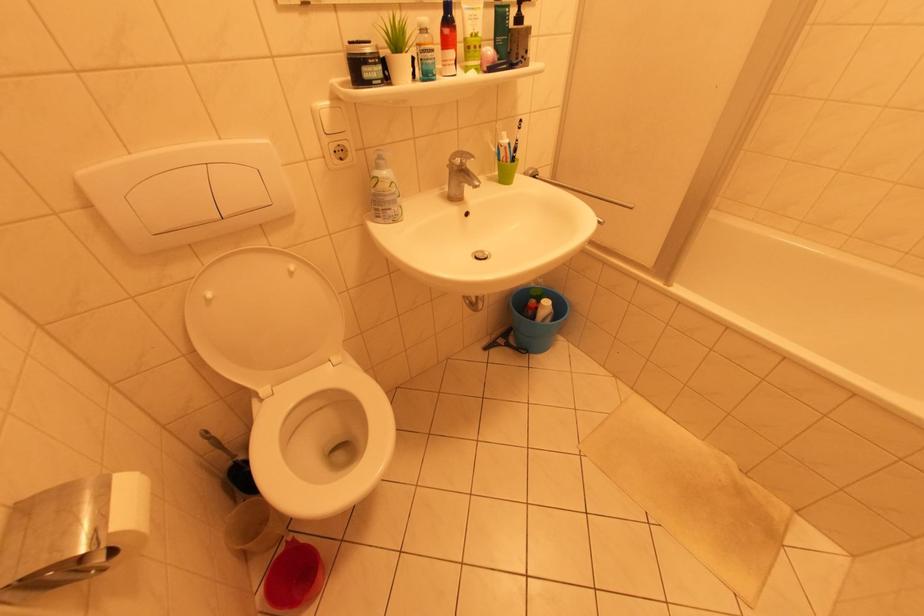
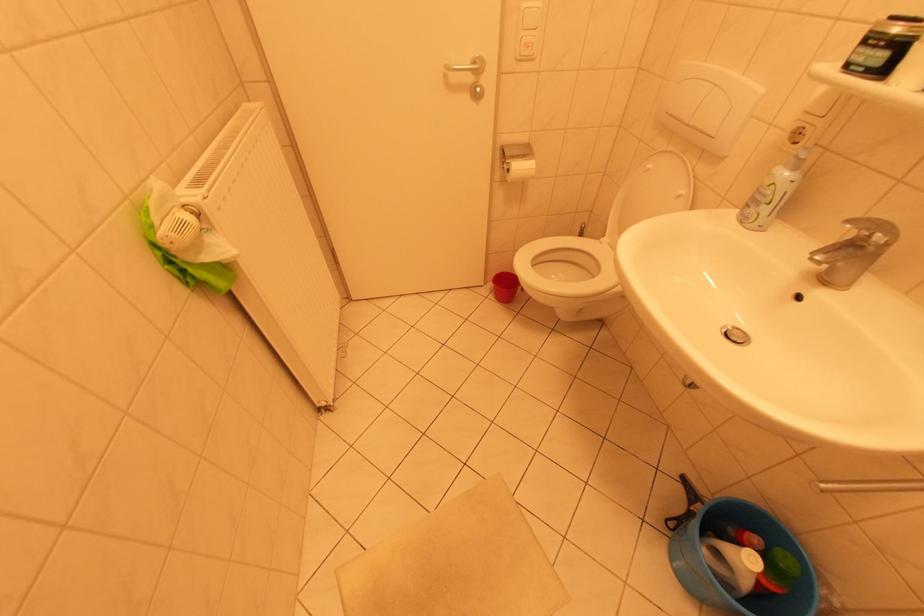
The first image is from the beginning of the video and the second image is from the end. How did the camera likely rotate when shooting the video?

The rotation direction of the camera is left-down.